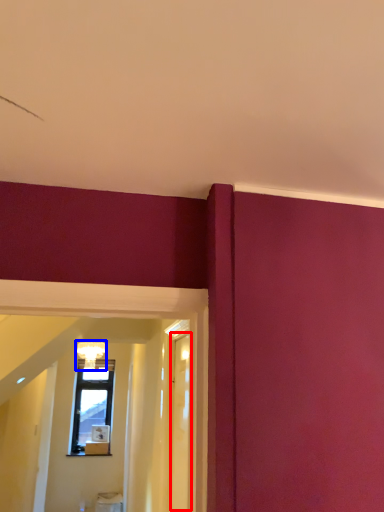
Question: Among these objects, which one is farthest to the camera, glass door (highlighted by a red box) or light fixture (highlighted by a blue box)?

Choices:
 (A) glass door
 (B) light fixture

Answer: (B)